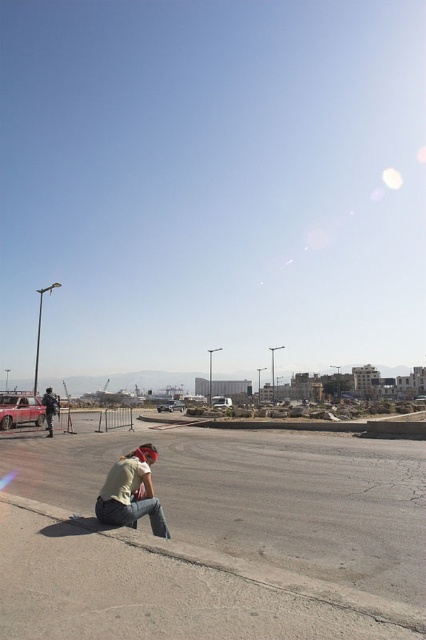
How distant is matte black jacket at lower left from metallic silver car at center?

matte black jacket at lower left is 39.95 meters away from metallic silver car at center.

Is matte black jacket at lower left smaller than metallic silver car at center?

Yes.

The width and height of the screenshot is (426, 640). Find the location of `matte black jacket at lower left`. matte black jacket at lower left is located at coordinates (49, 408).

From the picture: Does denim jeans at lower left have a lesser height compared to metallic silver car at center?

Yes, denim jeans at lower left is shorter than metallic silver car at center.

Which is more to the right, denim jeans at lower left or metallic silver car at center?

denim jeans at lower left

Does point (129, 525) lie behind point (180, 401)?

No, (129, 525) is closer to viewer.

In order to click on denim jeans at lower left in this screenshot , I will do `click(131, 492)`.

Based on the photo, does rustic red car at lower left have a greater height compared to metallic silver truck at center?

In fact, rustic red car at lower left may be shorter than metallic silver truck at center.

Is rustic red car at lower left positioned behind metallic silver truck at center?

No, it is in front of metallic silver truck at center.

Image resolution: width=426 pixels, height=640 pixels. I want to click on rustic red car at lower left, so click(20, 410).

Locate an element on the screen. rustic red car at lower left is located at coordinates (20, 410).